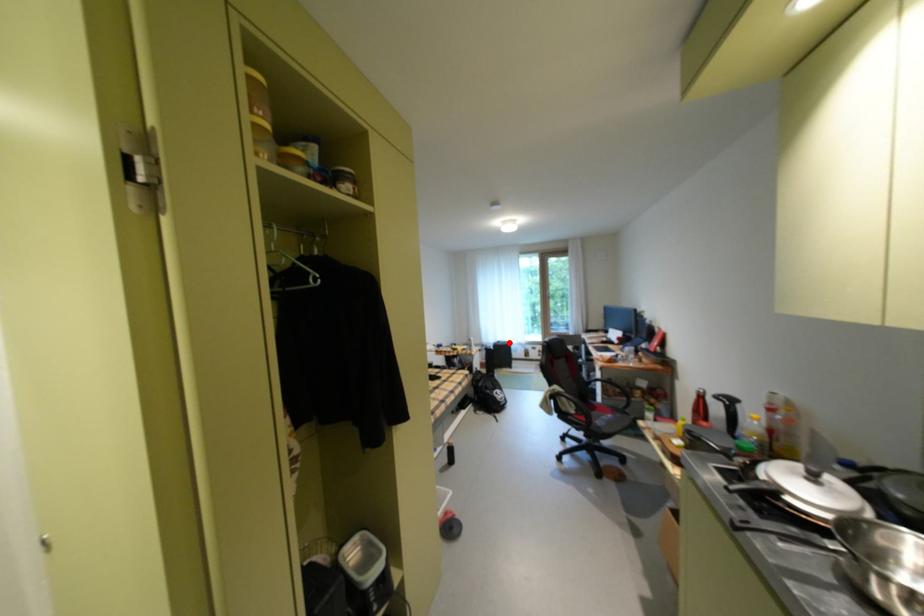
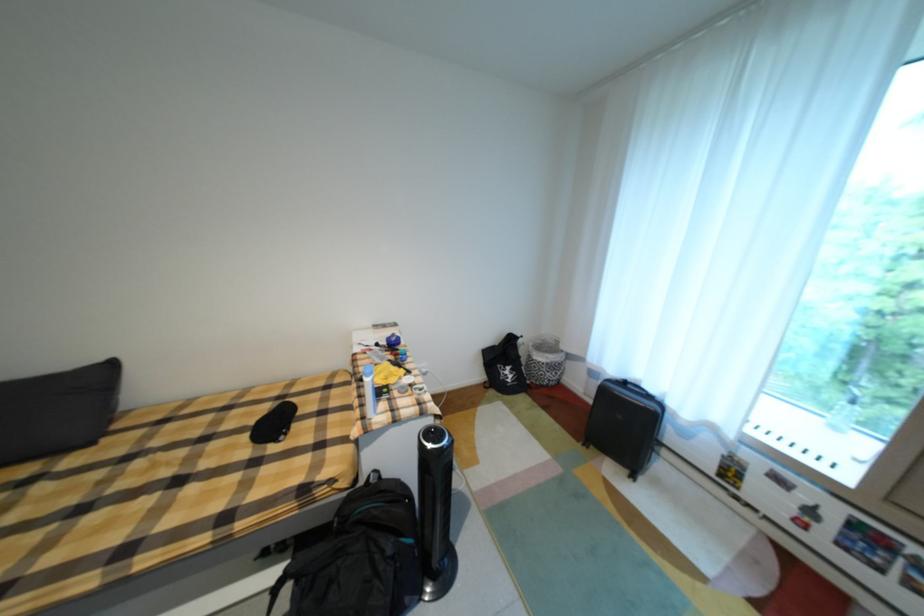
Where in the second image is the point corresponding to the highlighted location from the first image?

(635, 384)